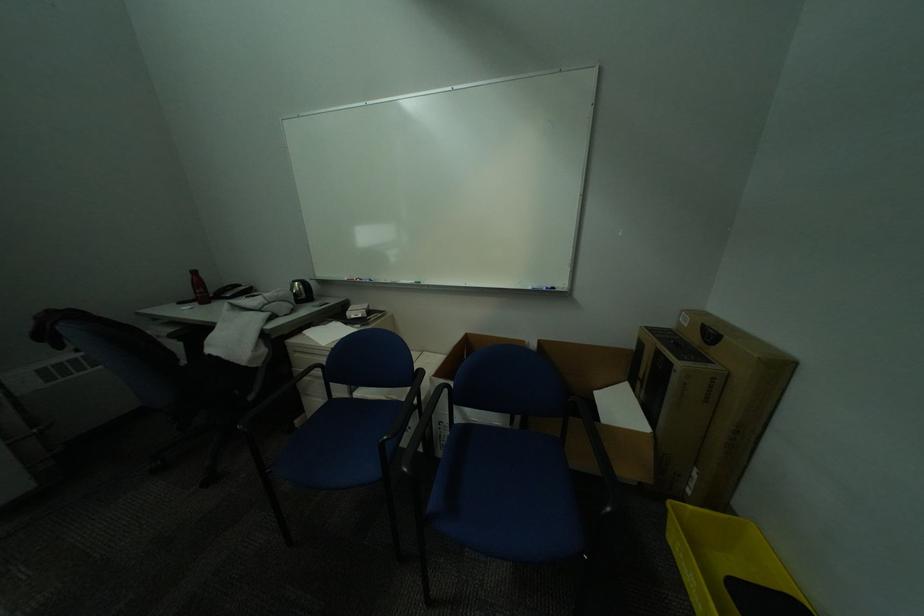
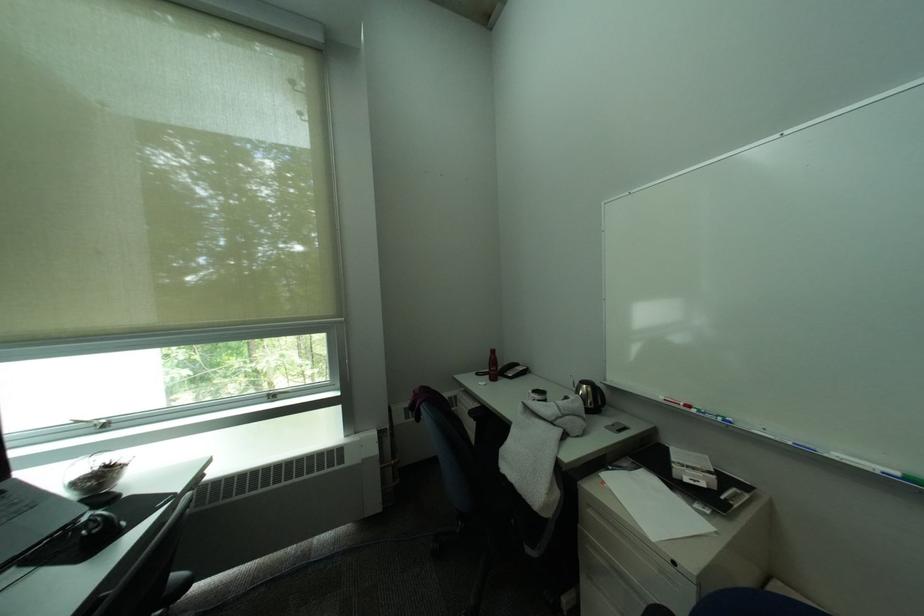
The point at [190,304] is marked in the first image. Where is the corresponding point in the second image?

(488, 376)